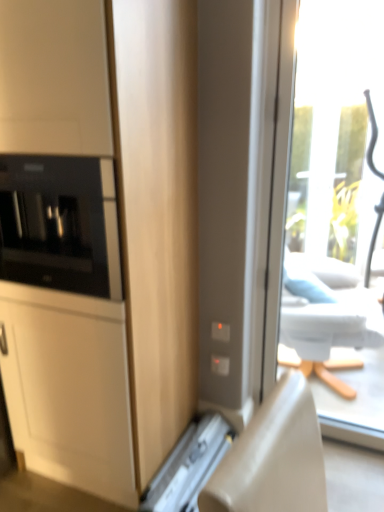
Question: Could you tell me if metallic silver drawer at lower center is facing black glass microwave at left?

Choices:
 (A) no
 (B) yes

Answer: (A)

Question: Is black glass microwave at left a part of metallic silver drawer at lower center?

Choices:
 (A) yes
 (B) no

Answer: (B)

Question: Does metallic silver drawer at lower center lie in front of black glass microwave at left?

Choices:
 (A) yes
 (B) no

Answer: (B)

Question: Is metallic silver drawer at lower center facing away from black glass microwave at left?

Choices:
 (A) no
 (B) yes

Answer: (A)

Question: Considering the relative sizes of metallic silver drawer at lower center and black glass microwave at left in the image provided, is metallic silver drawer at lower center shorter than black glass microwave at left?

Choices:
 (A) yes
 (B) no

Answer: (A)

Question: Is point (130, 37) positioned closer to the camera than point (200, 433)?

Choices:
 (A) farther
 (B) closer

Answer: (B)

Question: Based on their positions, is matte wood cabinet at left located to the left or right of metallic silver drawer at lower center?

Choices:
 (A) left
 (B) right

Answer: (A)

Question: Based on their sizes in the image, would you say matte wood cabinet at left is bigger or smaller than metallic silver drawer at lower center?

Choices:
 (A) big
 (B) small

Answer: (A)

Question: From a real-world perspective, relative to metallic silver drawer at lower center, is matte wood cabinet at left vertically above or below?

Choices:
 (A) above
 (B) below

Answer: (A)

Question: Is matte wood cabinet at left in front of or behind black glass microwave at left in the image?

Choices:
 (A) behind
 (B) front

Answer: (B)

Question: Visually, is matte wood cabinet at left positioned to the left or to the right of black glass microwave at left?

Choices:
 (A) right
 (B) left

Answer: (B)

Question: Considering the positions of point pos(147,53) and point pos(8,246), is point pos(147,53) closer or farther from the camera than point pos(8,246)?

Choices:
 (A) farther
 (B) closer

Answer: (B)

Question: From the image's perspective, is matte wood cabinet at left above or below black glass microwave at left?

Choices:
 (A) below
 (B) above

Answer: (A)

Question: Considering the positions of black glass microwave at left and metallic silver drawer at lower center in the image, is black glass microwave at left taller or shorter than metallic silver drawer at lower center?

Choices:
 (A) tall
 (B) short

Answer: (A)

Question: Is point (77, 286) positioned closer to the camera than point (210, 428)?

Choices:
 (A) farther
 (B) closer

Answer: (B)